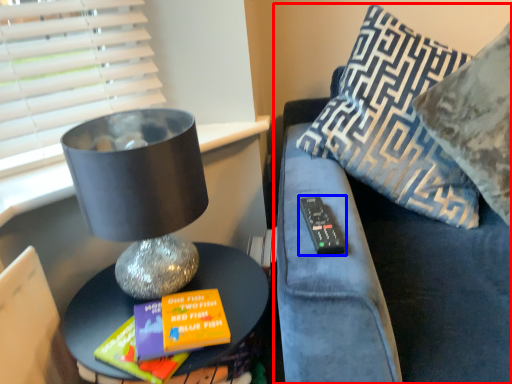
Question: Which object is closer to the camera taking this photo, furniture (highlighted by a red box) or remote (highlighted by a blue box)?

Choices:
 (A) furniture
 (B) remote

Answer: (A)